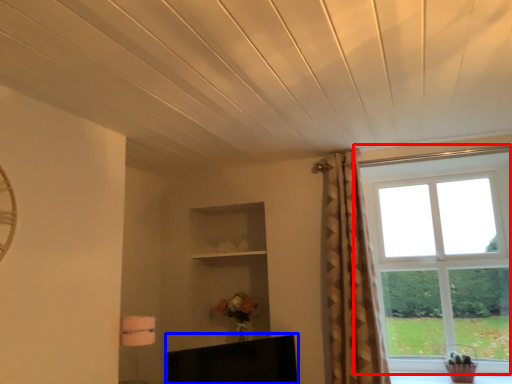
Question: Which object is closer to the camera taking this photo, window (highlighted by a red box) or furniture (highlighted by a blue box)?

Choices:
 (A) window
 (B) furniture

Answer: (B)